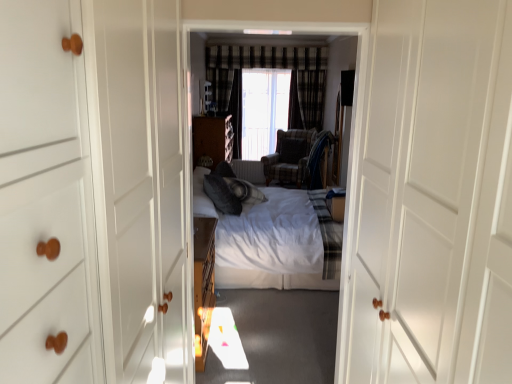
Question: In the image, is plaid fabric curtain at center positioned in front of or behind white wood door at center?

Choices:
 (A) front
 (B) behind

Answer: (B)

Question: Based on their sizes in the image, would you say plaid fabric curtain at center is bigger or smaller than white wood door at center?

Choices:
 (A) small
 (B) big

Answer: (A)

Question: Which object is positioned closest to the white wood door at center?

Choices:
 (A) plaid fabric armchair at center
 (B) transparent plastic window screen at center
 (C) matte brown cabinet at center
 (D) plaid fabric curtain at center
 (E) white soft bed at center

Answer: (A)

Question: Based on their relative distances, which object is farther from the plaid fabric armchair at center?

Choices:
 (A) plaid fabric curtain at center
 (B) white soft bed at center
 (C) white soft bed at center
 (D) white wood door at center
 (E) matte brown cabinet at center

Answer: (D)